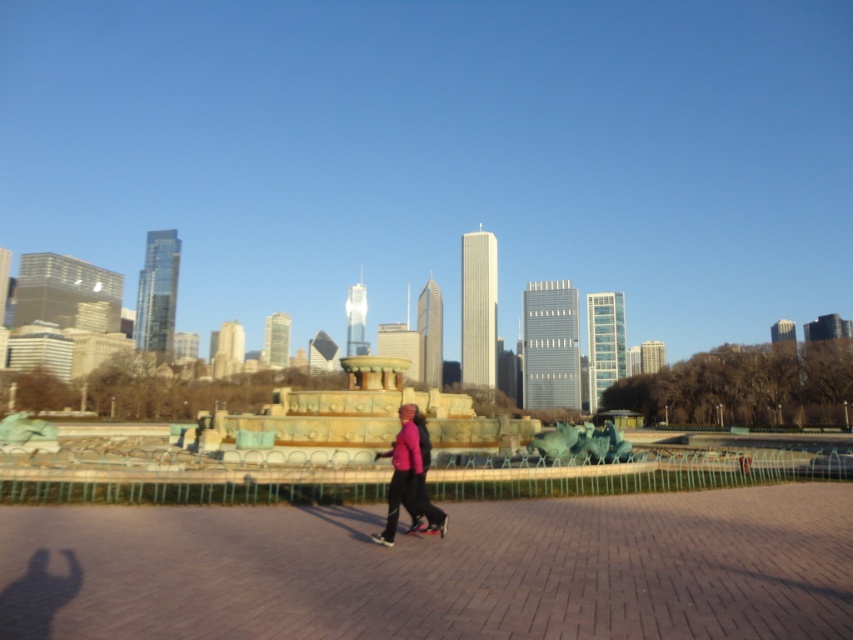
You are standing in the city square and want to take a photo of the fountain. You notice two points marked in the scene. The first point is at coordinates point (630, 572) and the second is at point (395, 476). Which point is closer to your camera position?

Point (630, 572) is closer to the camera than point (395, 476).